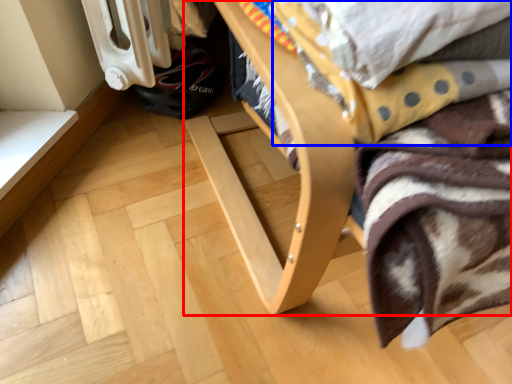
Question: Among these objects, which one is farthest to the camera, furniture (highlighted by a red box) or blanket (highlighted by a blue box)?

Choices:
 (A) furniture
 (B) blanket

Answer: (B)